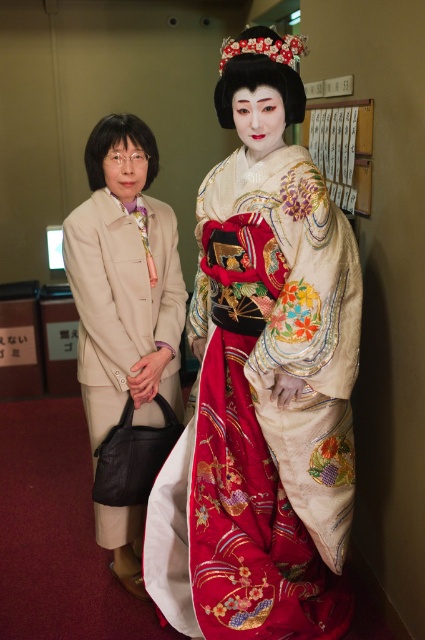
You are a photographer setting up a shoot in this hallway. You need to position a large camera tripod between the silky white kimono at center and the beige fabric robe at left. Since the tripod requires 1 meter of space, can you fit it there?

The silky white kimono at center is located above the beige fabric robe at left, so there is vertical space between them. However, the horizontal distance isn not specified. Without knowing the horizontal spacing, it is impossible to determine if the tripod can fit.

What is the exact coordinate of the silky white kimono at center?

The silky white kimono at center is located at point (263, 381).

You are an interior designer planning to place two items in a room. The silky white kimono at center and the beige fabric robe at left need to be arranged. Considering their sizes, which one should you allocate more space for?

The silky white kimono at center has a larger size compared to beige fabric robe at left, so you should allocate more space for the silky white kimono at center.